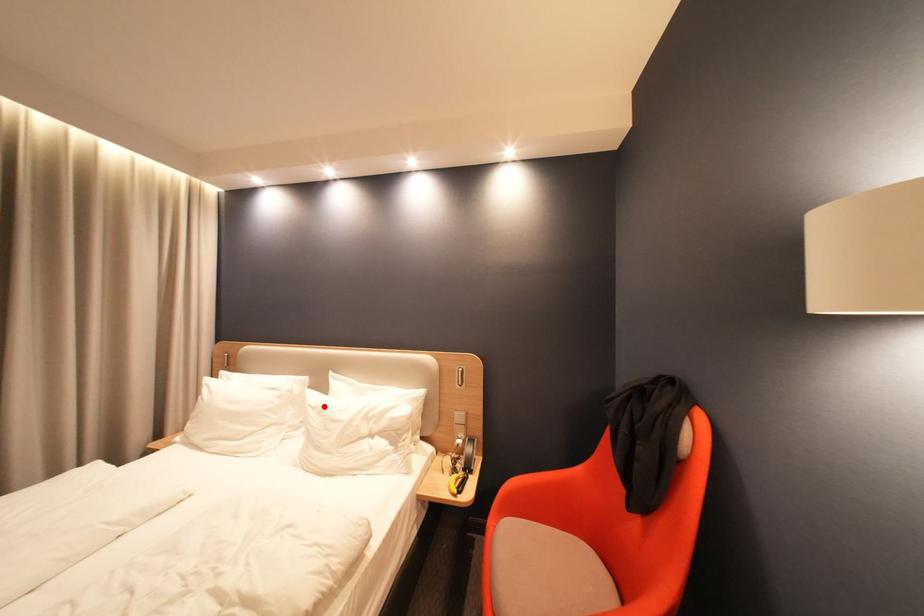
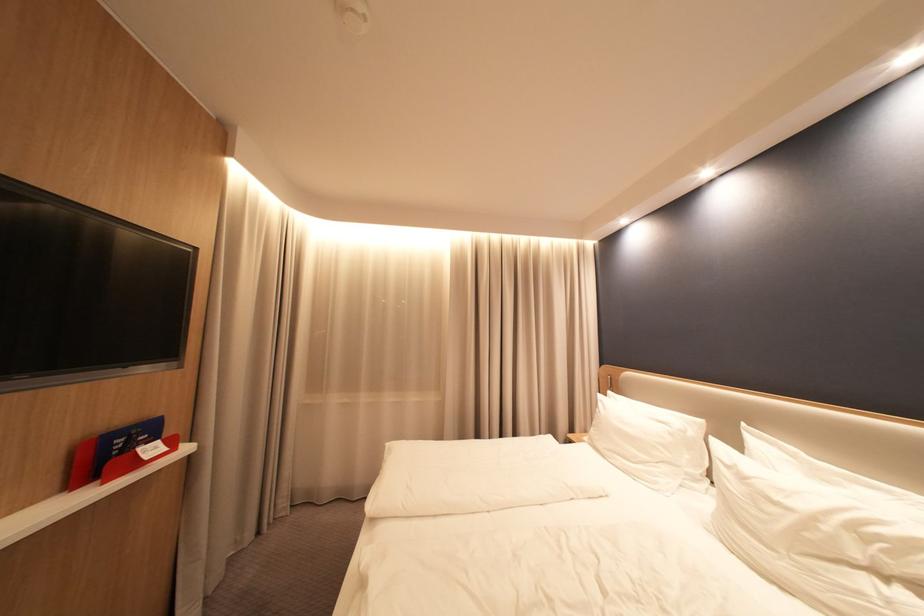
Locate, in the second image, the point that corresponds to the highlighted location in the first image.

(737, 464)